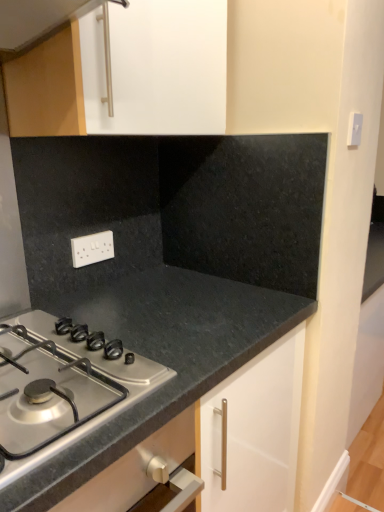
This screenshot has width=384, height=512. What do you see at coordinates (92, 248) in the screenshot? I see `white plastic electric outlet at center` at bounding box center [92, 248].

What do you see at coordinates (160, 359) in the screenshot? I see `black granite countertop at center` at bounding box center [160, 359].

Where is `satin silver gas stove at lower left`? satin silver gas stove at lower left is located at coordinates (61, 389).

Considering the positions of objects black granite countertop at center and satin silver gas stove at lower left in the image provided, who is more to the left, black granite countertop at center or satin silver gas stove at lower left?

From the viewer's perspective, satin silver gas stove at lower left appears more on the left side.

How distant is black granite countertop at center from satin silver gas stove at lower left?

black granite countertop at center and satin silver gas stove at lower left are 6.12 inches apart.

From the image's perspective, who appears lower, black granite countertop at center or satin silver gas stove at lower left?

black granite countertop at center is shown below in the image.

Between black granite countertop at center and satin silver gas stove at lower left, which one has larger size?

black granite countertop at center.

From a real-world perspective, is white plastic electric outlet at center positioned above or below satin silver gas stove at lower left?

Clearly, from a real-world perspective, white plastic electric outlet at center is above satin silver gas stove at lower left.

Is white plastic electric outlet at center aimed at satin silver gas stove at lower left?

No, white plastic electric outlet at center is not oriented towards satin silver gas stove at lower left.

Is white plastic electric outlet at center wider or thinner than satin silver gas stove at lower left?

Considering their sizes, white plastic electric outlet at center looks slimmer than satin silver gas stove at lower left.

Is point (25, 361) positioned before point (52, 459)?

No, it is not.

Where is `countertop below the satin silver gas stove at lower left (from a real-world perspective)`? countertop below the satin silver gas stove at lower left (from a real-world perspective) is located at coordinates (160, 359).

From a real-world perspective, does satin silver gas stove at lower left stand above black granite countertop at center?

Yes, from a real-world perspective, satin silver gas stove at lower left is above black granite countertop at center.

Considering the sizes of objects satin silver gas stove at lower left and black granite countertop at center in the image provided, who is smaller, satin silver gas stove at lower left or black granite countertop at center?

With smaller size is satin silver gas stove at lower left.

Is black granite countertop at center in front of white plastic electric outlet at center?

Yes, the depth of black granite countertop at center is less than that of white plastic electric outlet at center.

In the image, there is a white plastic electric outlet at center. Where is `countertop below it (from the image's perspective)`? Image resolution: width=384 pixels, height=512 pixels. countertop below it (from the image's perspective) is located at coordinates (160, 359).

Consider the image. Can you confirm if black granite countertop at center is bigger than white plastic electric outlet at center?

Correct, black granite countertop at center is larger in size than white plastic electric outlet at center.

Based on their positions, is white plastic electric outlet at center located to the left or right of black granite countertop at center?

In the image, white plastic electric outlet at center appears on the left side of black granite countertop at center.

Based on their sizes in the image, would you say white plastic electric outlet at center is bigger or smaller than black granite countertop at center?

Clearly, white plastic electric outlet at center is smaller in size than black granite countertop at center.

From a real-world perspective, which is physically above, white plastic electric outlet at center or black granite countertop at center?

white plastic electric outlet at center, from a real-world perspective.

Is white plastic electric outlet at center facing away from black granite countertop at center?

white plastic electric outlet at center is not turned away from black granite countertop at center.

Does point (164, 375) appear closer or farther from the camera than point (71, 246)?

Clearly, point (164, 375) is closer to the camera than point (71, 246).

Based on the photo, considering the sizes of objects satin silver gas stove at lower left and white plastic electric outlet at center in the image provided, who is thinner, satin silver gas stove at lower left or white plastic electric outlet at center?

white plastic electric outlet at center is thinner.

Does satin silver gas stove at lower left turn towards white plastic electric outlet at center?

No.

From a real-world perspective, which is physically above, satin silver gas stove at lower left or white plastic electric outlet at center?

white plastic electric outlet at center.

This screenshot has width=384, height=512. In order to click on gas stove on the left side of black granite countertop at center in this screenshot , I will do `click(61, 389)`.

Identify the location of electric outlet on the right of satin silver gas stove at lower left. (92, 248).

Estimate the real-world distances between objects in this image. Which object is further from satin silver gas stove at lower left, black granite countertop at center or white plastic electric outlet at center?

white plastic electric outlet at center is further to satin silver gas stove at lower left.

Based on their spatial positions, is satin silver gas stove at lower left or black granite countertop at center closer to white plastic electric outlet at center?

The object closer to white plastic electric outlet at center is black granite countertop at center.

Based on their spatial positions, is satin silver gas stove at lower left or white plastic electric outlet at center closer to black granite countertop at center?

satin silver gas stove at lower left is closer to black granite countertop at center.

Considering their positions, is white plastic electric outlet at center positioned closer to satin silver gas stove at lower left than black granite countertop at center?

Among the two, black granite countertop at center is located nearer to satin silver gas stove at lower left.

When comparing their distances from black granite countertop at center, does white plastic electric outlet at center or satin silver gas stove at lower left seem further?

white plastic electric outlet at center lies further to black granite countertop at center than the other object.

From the picture: Which object lies further to the anchor point white plastic electric outlet at center, black granite countertop at center or satin silver gas stove at lower left?

satin silver gas stove at lower left lies further to white plastic electric outlet at center than the other object.

Identify the location of countertop positioned between satin silver gas stove at lower left and white plastic electric outlet at center from near to far. (160, 359).